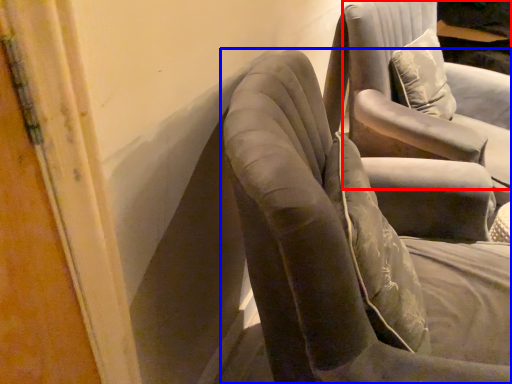
Question: Which of the following is the farthest to the observer, chair (highlighted by a red box) or chair (highlighted by a blue box)?

Choices:
 (A) chair
 (B) chair

Answer: (A)